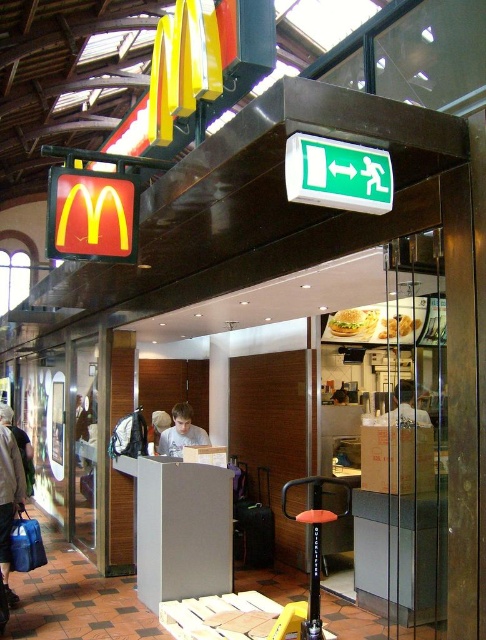
Does green plastic emergency exit sign at upper center appear on the left side of light blue shirt at center?

Incorrect, green plastic emergency exit sign at upper center is not on the left side of light blue shirt at center.

How much distance is there between green plastic emergency exit sign at upper center and light blue shirt at center?

green plastic emergency exit sign at upper center and light blue shirt at center are 4.26 meters apart from each other.

Does point (317, 198) come in front of point (194, 442)?

Yes, point (317, 198) is closer to viewer.

Where is `green plastic emergency exit sign at upper center`? Image resolution: width=486 pixels, height=640 pixels. green plastic emergency exit sign at upper center is located at coordinates (337, 173).

In the scene shown: Who is positioned more to the right, light blue shirt at center or golden crispy hamburger at center?

Positioned to the right is golden crispy hamburger at center.

Is point (173, 422) less distant than point (359, 310)?

No, (173, 422) is behind (359, 310).

Find the location of a particular element. Image resolution: width=486 pixels, height=640 pixels. light blue shirt at center is located at coordinates (180, 433).

Does denim jacket at lower left come in front of light blue shirt at center?

Yes, it is.

Can you confirm if denim jacket at lower left is shorter than light blue shirt at center?

In fact, denim jacket at lower left may be taller than light blue shirt at center.

Locate an element on the screen. denim jacket at lower left is located at coordinates (9, 499).